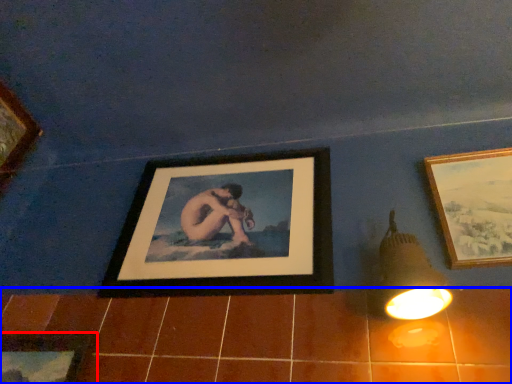
Question: Among these objects, which one is nearest to the camera, picture frame (highlighted by a red box) or ceramic tile (highlighted by a blue box)?

Choices:
 (A) picture frame
 (B) ceramic tile

Answer: (B)